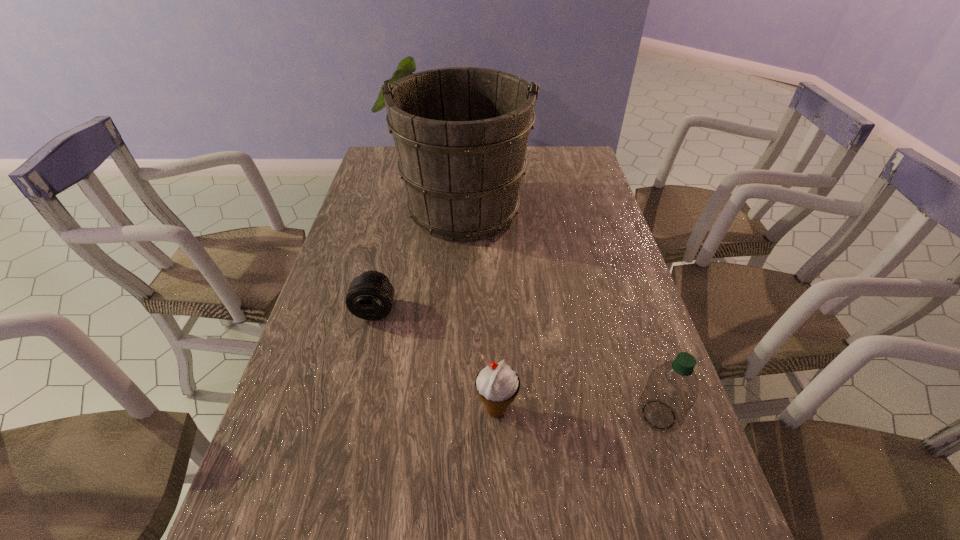
This screenshot has height=540, width=960. I want to click on free space located on the front-facing side of the telephoto lens, so (354, 396).

At what (x,y) coordinates should I click in order to perform the action: click on object that is positioned at the far edge. Please return your answer as a coordinate pair (x, y). This screenshot has width=960, height=540. Looking at the image, I should click on (461, 133).

The height and width of the screenshot is (540, 960). I want to click on bucket that is at the left edge, so click(461, 133).

The height and width of the screenshot is (540, 960). I want to click on telephoto lens present at the left edge, so click(370, 296).

Identify the location of object that is at the right edge. (672, 389).

Identify the location of object that is at the far left corner. The height and width of the screenshot is (540, 960). (461, 133).

Locate an element on the screen. The image size is (960, 540). vacant space at the far edge is located at coordinates (546, 160).

The image size is (960, 540). In the image, there is a desktop. Identify the location of free space at the left edge. (267, 534).

Find the location of a particular element. free space at the right edge of the desktop is located at coordinates (635, 360).

The width and height of the screenshot is (960, 540). Find the location of `free space between the water bottle and the telephoto lens`. free space between the water bottle and the telephoto lens is located at coordinates (516, 362).